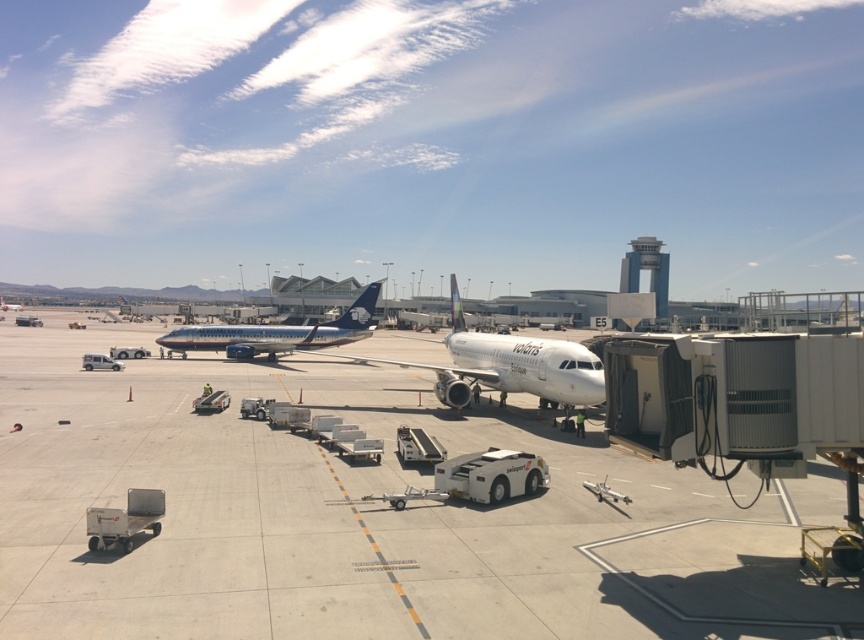
You are a passenger standing at the jet bridge connected to the white glossy airplane at center and want to take a photo of the blue metallic airplane at center. Which direction should you face to capture it in your camera?

The white glossy airplane at center is to the right of the blue metallic airplane at center, so you should face to the left to capture the blue metallic airplane at center in your camera.

You are a maintenance worker on the airport tarmac. You need to inspect the white glossy airplane at center. From your current position on the white smooth tarmac at center, which direction should you move to reach the airplane?

The white smooth tarmac at center is below the white glossy airplane at center, so you should move upward to reach the airplane.